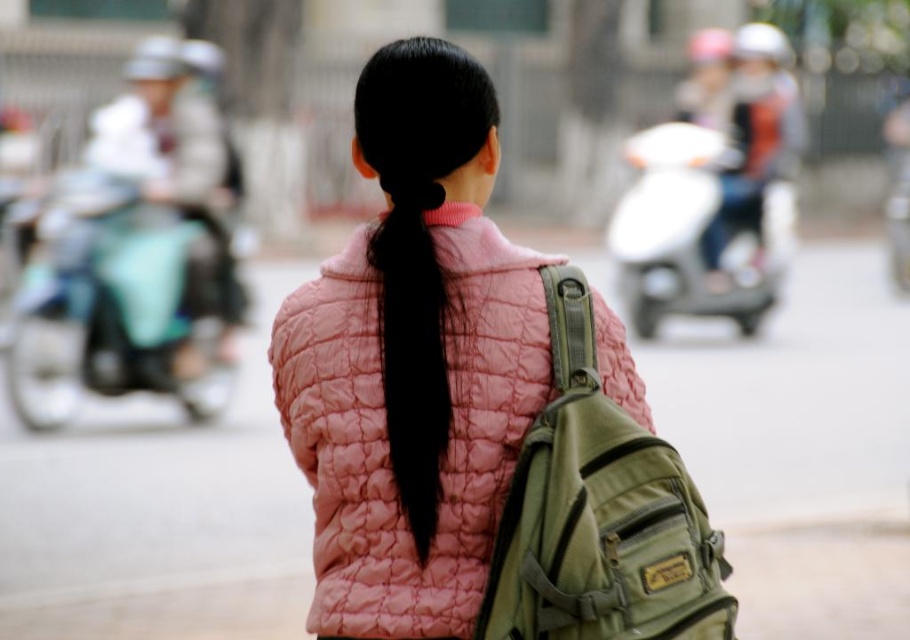
Who is more distant from viewer, (531, 490) or (430, 349)?

Point (430, 349)

Between point (567, 460) and point (430, 200), which one is positioned in front?

Point (567, 460) is more forward.

The height and width of the screenshot is (640, 910). What are the coordinates of `olive green canvas backpack at center` in the screenshot? It's located at (599, 513).

Is point (472, 280) farther from camera compared to point (200, 336)?

That is False.

Measure the distance from pink quilted jacket at center to teal matte motorcycle at left.

pink quilted jacket at center is 12.86 meters from teal matte motorcycle at left.

Image resolution: width=910 pixels, height=640 pixels. In order to click on pink quilted jacket at center in this screenshot , I will do `click(413, 360)`.

You are a GUI agent. You are given a task and a screenshot of the screen. Output one action in this format:
    pyautogui.click(x=<x>, y=<y>)
    Task: Click on the pink quilted jacket at center
    This screenshot has width=910, height=640.
    Given the screenshot: What is the action you would take?
    pyautogui.click(x=413, y=360)

The height and width of the screenshot is (640, 910). I want to click on pink quilted jacket at center, so click(413, 360).

Can you confirm if pink quilted jacket at center is thinner than black silky hair at center?

Incorrect, pink quilted jacket at center's width is not less than black silky hair at center's.

Between point (329, 632) and point (406, 403), which one is positioned behind?

Positioned behind is point (329, 632).

Locate an element on the screen. The image size is (910, 640). pink quilted jacket at center is located at coordinates (413, 360).